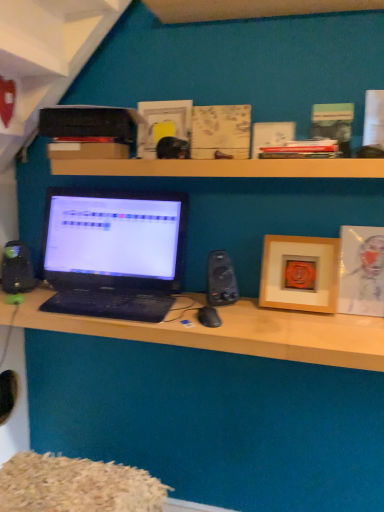
Image resolution: width=384 pixels, height=512 pixels. I want to click on black textured keyboard at center, so coord(110,304).

Locate an element on the screen. This screenshot has height=512, width=384. wooden picture frame at right, marked as the second picture frame in a right-to-left arrangement is located at coordinates (300, 273).

Describe the element at coordinates (114, 253) in the screenshot. I see `matte black laptop at center` at that location.

Measure the distance between matte wooden picture frame at right, which is counted as the second picture frame, starting from the left, and camera.

matte wooden picture frame at right, which is counted as the second picture frame, starting from the left, is 1.40 meters away from camera.

What do you see at coordinates (221, 279) in the screenshot?
I see `black plastic speaker at center-right, the second speaker in the left-to-right sequence` at bounding box center [221, 279].

At what (x,y) coordinates should I click in order to perform the action: click on black textured keyboard at center. Please return your answer as a coordinate pair (x, y). This screenshot has width=384, height=512. Looking at the image, I should click on (110, 304).

From a real-world perspective, is black textured keyboard at center beneath black matte mouse at center?

Actually, black textured keyboard at center is physically above black matte mouse at center in the real world.

Image resolution: width=384 pixels, height=512 pixels. What are the coordinates of `mouse that is under the black textured keyboard at center (from a real-world perspective)` in the screenshot? It's located at (209, 317).

Between black textured keyboard at center and black matte mouse at center, which one has larger width?

black textured keyboard at center is wider.

From the image's perspective, is black textured keyboard at center located beneath black matte mouse at center?

No.

Consider the image. Which of these two, matte black laptop at center or wooden picture frame at right, which is the 1th picture frame in left-to-right order, is wider?

Wider between the two is matte black laptop at center.

Is matte black laptop at center facing towards wooden picture frame at right, which is the 1th picture frame in left-to-right order?

No, matte black laptop at center is not aimed at wooden picture frame at right, which is the 1th picture frame in left-to-right order.

Is point (72, 303) in front of point (314, 294)?

No, (72, 303) is further to viewer.

Which is more to the right, matte black laptop at center or wooden picture frame at right, marked as the second picture frame in a right-to-left arrangement?

Positioned to the right is wooden picture frame at right, marked as the second picture frame in a right-to-left arrangement.

Can you tell me how much black matte mouse at center and black plastic speaker at center-right, the second speaker in the left-to-right sequence, differ in facing direction?

The angle between the facing direction of black matte mouse at center and the facing direction of black plastic speaker at center-right, the second speaker in the left-to-right sequence, is 3.76 degrees.

Is black matte mouse at center far from black plastic speaker at center-right, the second speaker in the left-to-right sequence?

Actually, black matte mouse at center and black plastic speaker at center-right, the second speaker in the left-to-right sequence, are a little close together.

Could you measure the distance between black matte mouse at center and black plastic speaker at center-right, which is the 1th speaker in right-to-left order?

A distance of 3.93 inches exists between black matte mouse at center and black plastic speaker at center-right, which is the 1th speaker in right-to-left order.

Is black matte mouse at center shorter than black plastic speaker at center-right, which is the 1th speaker in right-to-left order?

Correct, black matte mouse at center is not as tall as black plastic speaker at center-right, which is the 1th speaker in right-to-left order.

Is there a large distance between wooden picture frame at right, marked as the second picture frame in a right-to-left arrangement, and wooden at upper center?

No, wooden picture frame at right, marked as the second picture frame in a right-to-left arrangement, is in close proximity to wooden at upper center.

Considering the positions of point (272, 296) and point (128, 175), is point (272, 296) closer or farther from the camera than point (128, 175)?

Point (272, 296) is farther from the camera than point (128, 175).

Which of these two, wooden picture frame at right, which is the 1th picture frame in left-to-right order, or wooden at upper center, is smaller?

wooden picture frame at right, which is the 1th picture frame in left-to-right order, is smaller.

In the scene shown: Considering the relative positions of wooden picture frame at right, which is the 1th picture frame in left-to-right order, and wooden at upper center in the image provided, is wooden picture frame at right, which is the 1th picture frame in left-to-right order, in front of wooden at upper center?

No.

Does matte wooden picture frame at right, arranged as the first picture frame when viewed from the right, come in front of black matte mouse at center?

No, the depth of matte wooden picture frame at right, arranged as the first picture frame when viewed from the right, is greater than that of black matte mouse at center.

Considering the relative sizes of matte wooden picture frame at right, arranged as the first picture frame when viewed from the right, and black matte mouse at center in the image provided, is matte wooden picture frame at right, arranged as the first picture frame when viewed from the right, smaller than black matte mouse at center?

Actually, matte wooden picture frame at right, arranged as the first picture frame when viewed from the right, might be larger than black matte mouse at center.

Is there a large distance between matte wooden picture frame at right, which is counted as the second picture frame, starting from the left, and black matte mouse at center?

No, matte wooden picture frame at right, which is counted as the second picture frame, starting from the left, is not far away from black matte mouse at center.

Can you tell me how much wooden picture frame at right, which is the 1th picture frame in left-to-right order, and black plastic speaker at left, acting as the first speaker starting from the left, differ in facing direction?

37.9 degrees separate the facing orientations of wooden picture frame at right, which is the 1th picture frame in left-to-right order, and black plastic speaker at left, acting as the first speaker starting from the left.

Are wooden picture frame at right, marked as the second picture frame in a right-to-left arrangement, and black plastic speaker at left, acting as the first speaker starting from the left, located far from each other?

wooden picture frame at right, marked as the second picture frame in a right-to-left arrangement, is near black plastic speaker at left, acting as the first speaker starting from the left, not far away.

Does wooden picture frame at right, which is the 1th picture frame in left-to-right order, have a lesser width compared to black plastic speaker at left, which appears as the 2th speaker when viewed from the right?

No, wooden picture frame at right, which is the 1th picture frame in left-to-right order, is not thinner than black plastic speaker at left, which appears as the 2th speaker when viewed from the right.

There is a black plastic speaker at left, acting as the first speaker starting from the left. At what (x,y) coordinates should I click in order to perform the action: click on the 1st picture frame above it (from a real-world perspective). Please return your answer as a coordinate pair (x, y). Looking at the image, I should click on (300, 273).

Which of these two, black matte mouse at center or matte black laptop at center, is smaller?

Smaller between the two is black matte mouse at center.

From a real-world perspective, which is physically below, black matte mouse at center or matte black laptop at center?

From a 3D spatial view, black matte mouse at center is below.

Does black matte mouse at center appear on the right side of matte black laptop at center?

Correct, you'll find black matte mouse at center to the right of matte black laptop at center.

Is black matte mouse at center not close to matte black laptop at center?

No, black matte mouse at center is not far away from matte black laptop at center.

The width and height of the screenshot is (384, 512). Find the location of `mouse below the black textured keyboard at center (from the image's perspective)`. mouse below the black textured keyboard at center (from the image's perspective) is located at coordinates (209, 317).

Where is `the 1st picture frame in front when counting from the matte black laptop at center`? Image resolution: width=384 pixels, height=512 pixels. the 1st picture frame in front when counting from the matte black laptop at center is located at coordinates (300, 273).

Which object lies further to the anchor point black textured keyboard at center, black matte mouse at center or wooden picture frame at right, which is the 1th picture frame in left-to-right order?

Based on the image, wooden picture frame at right, which is the 1th picture frame in left-to-right order, appears to be further to black textured keyboard at center.

Looking at the image, which one is located closer to matte wooden picture frame at right, which is counted as the second picture frame, starting from the left, wooden at upper center or black plastic speaker at left, which appears as the 2th speaker when viewed from the right?

Among the two, wooden at upper center is located nearer to matte wooden picture frame at right, which is counted as the second picture frame, starting from the left.

Looking at the image, which one is located further to matte wooden picture frame at right, which is counted as the second picture frame, starting from the left, wooden picture frame at right, marked as the second picture frame in a right-to-left arrangement, or matte black laptop at center?

Among the two, matte black laptop at center is located further to matte wooden picture frame at right, which is counted as the second picture frame, starting from the left.

When comparing their distances from matte wooden picture frame at right, which is counted as the second picture frame, starting from the left, does matte black laptop at center or black textured keyboard at center seem further?

black textured keyboard at center is positioned further to the anchor matte wooden picture frame at right, which is counted as the second picture frame, starting from the left.

Based on their spatial positions, is wooden picture frame at right, which is the 1th picture frame in left-to-right order, or black matte mouse at center closer to black textured keyboard at center?

black matte mouse at center is closer to black textured keyboard at center.

Considering their positions, is black matte mouse at center positioned further to wooden picture frame at right, which is the 1th picture frame in left-to-right order, than matte wooden picture frame at right, which is counted as the second picture frame, starting from the left?

Among the two, black matte mouse at center is located further to wooden picture frame at right, which is the 1th picture frame in left-to-right order.

Looking at this image, from the image, which object appears to be nearer to black matte mouse at center, black plastic speaker at left, acting as the first speaker starting from the left, or black textured keyboard at center?

black textured keyboard at center is positioned closer to the anchor black matte mouse at center.

Estimate the real-world distances between objects in this image. Which object is closer to wooden at upper center, matte wooden picture frame at right, arranged as the first picture frame when viewed from the right, or wooden picture frame at right, marked as the second picture frame in a right-to-left arrangement?

wooden picture frame at right, marked as the second picture frame in a right-to-left arrangement.

Locate an element on the screen. The image size is (384, 512). laptop between black plastic speaker at left, acting as the first speaker starting from the left, and black matte mouse at center, in the horizontal direction is located at coordinates (114, 253).

You are a GUI agent. You are given a task and a screenshot of the screen. Output one action in this format:
    pyautogui.click(x=<x>, y=<y>)
    Task: Click on the desk between matte black laptop at center and wooden picture frame at right, which is the 1th picture frame in left-to-right order, from left to right
    Image resolution: width=384 pixels, height=512 pixels.
    Given the screenshot: What is the action you would take?
    pyautogui.click(x=236, y=332)

Locate an element on the screen. laptop between black textured keyboard at center and matte black laptop at center in the horizontal direction is located at coordinates (114, 253).

The width and height of the screenshot is (384, 512). Identify the location of laptop between black textured keyboard at center and matte wooden picture frame at right, which is counted as the second picture frame, starting from the left. (114, 253).